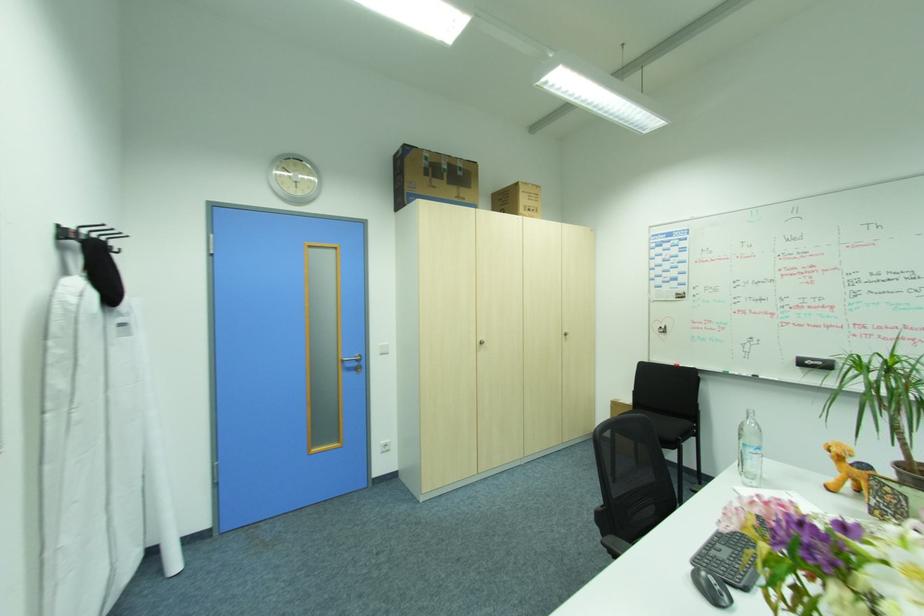
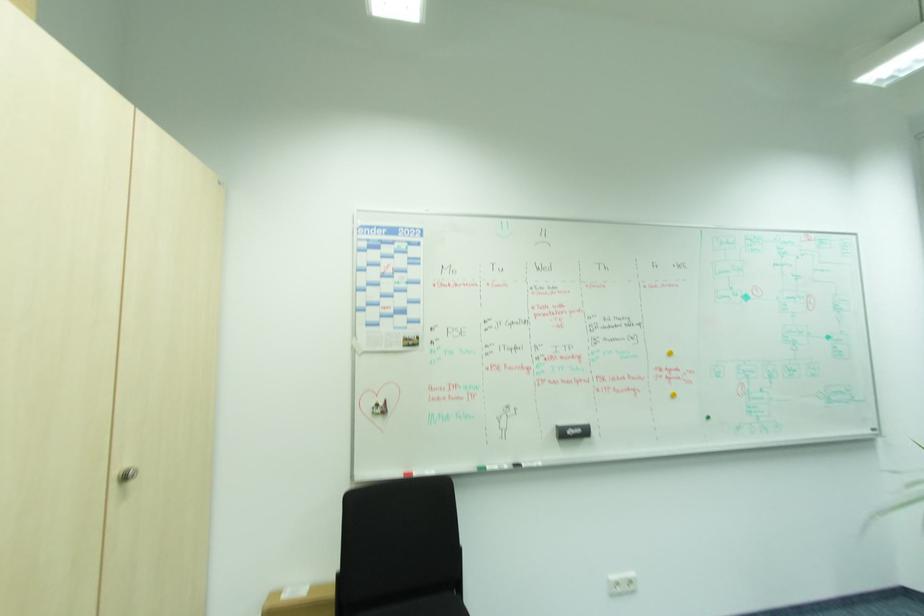
Where in the second image is the point corresponding to (766,377) from the first image?

(528, 464)